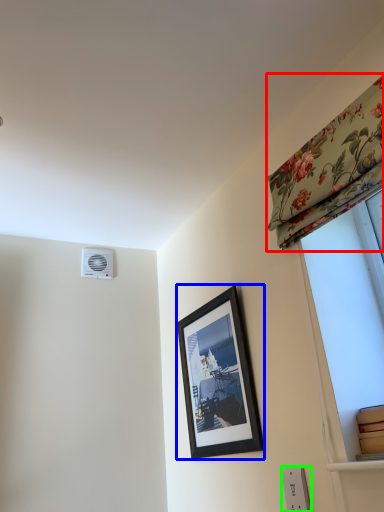
Question: Which object is the closest to the curtain (highlighted by a red box)? Choose among these: picture frame (highlighted by a blue box) or electric outlet (highlighted by a green box).

Choices:
 (A) picture frame
 (B) electric outlet

Answer: (A)